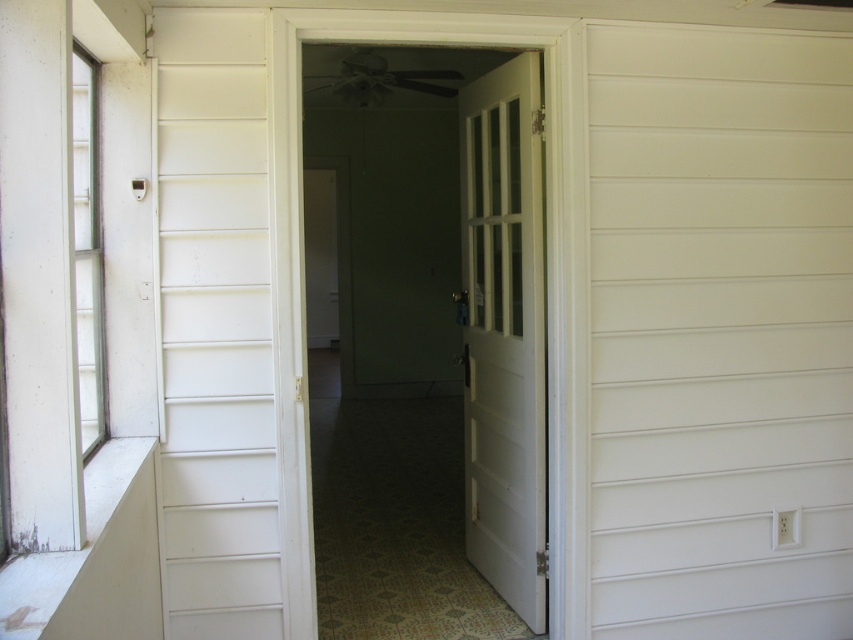
Question: Does white wooden door at center appear on the left side of clear glass window at left?

Choices:
 (A) no
 (B) yes

Answer: (A)

Question: In this image, where is white wooden door at center located relative to clear glass window at left?

Choices:
 (A) above
 (B) below

Answer: (B)

Question: Considering the real-world distances, which object is closest to the white glossy door at center?

Choices:
 (A) clear glass window at left
 (B) white wooden door at center

Answer: (B)

Question: Which point is closer to the camera?

Choices:
 (A) (492, 444)
 (B) (77, 81)

Answer: (B)

Question: Which point appears farthest from the camera in this image?

Choices:
 (A) (80, 129)
 (B) (432, 380)
 (C) (515, 280)

Answer: (B)

Question: Does white glossy door at center appear under white wooden door at center?

Choices:
 (A) no
 (B) yes

Answer: (A)